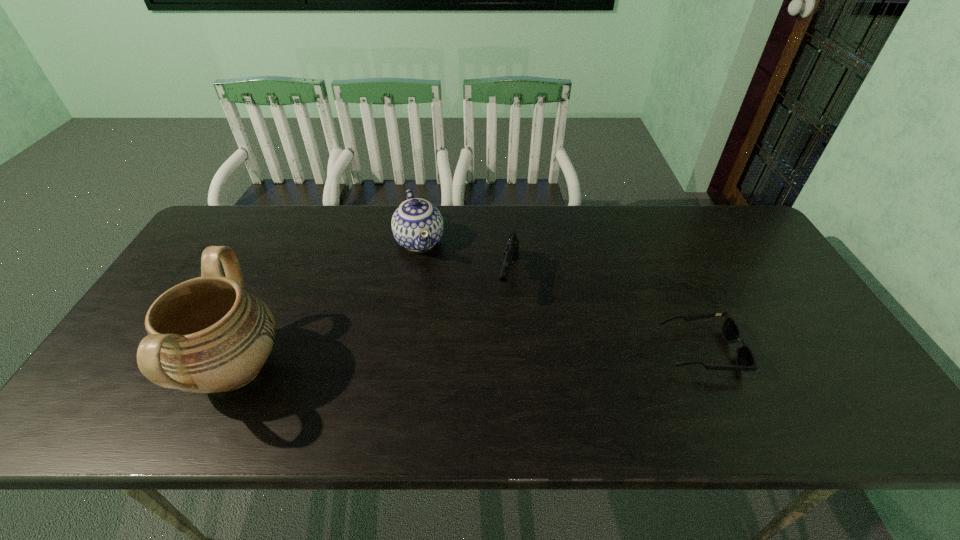
Locate an element on the screen. The image size is (960, 540). vacant area situated at the end of the barrel of the gun is located at coordinates (490, 389).

Where is `vacant space located 0.080m at the end of the barrel of the gun`? The width and height of the screenshot is (960, 540). vacant space located 0.080m at the end of the barrel of the gun is located at coordinates (503, 329).

You are a GUI agent. You are given a task and a screenshot of the screen. Output one action in this format:
    pyautogui.click(x=<x>, y=<y>)
    Task: Click on the vacant region located 0.200m at the end of the barrel of the gun
    This screenshot has height=540, width=960.
    Given the screenshot: What is the action you would take?
    pyautogui.click(x=494, y=367)

The image size is (960, 540). Find the location of `free space located 0.270m at the spout of the chinaware`. free space located 0.270m at the spout of the chinaware is located at coordinates (446, 336).

Find the location of a particular element. The image size is (960, 540). vacant space located at the spout of the chinaware is located at coordinates (458, 370).

Where is `blank space located at the spout of the chinaware`? This screenshot has height=540, width=960. blank space located at the spout of the chinaware is located at coordinates (454, 361).

Locate an element on the screen. gun that is positioned at the far edge is located at coordinates (511, 252).

Identify the location of chinaware situated at the far edge. (417, 225).

Locate an element on the screen. The width and height of the screenshot is (960, 540). urn situated at the near edge is located at coordinates (205, 335).

Image resolution: width=960 pixels, height=540 pixels. In order to click on sunglasses at the near edge in this screenshot , I will do `click(745, 358)`.